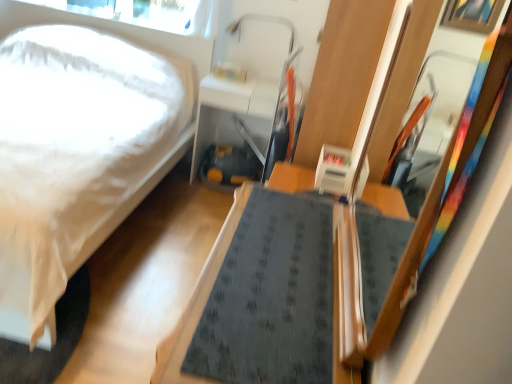
Question: Considering the positions of wooden framed mirror at right and transparent glass window screen at upper left in the image, is wooden framed mirror at right wider or thinner than transparent glass window screen at upper left?

Choices:
 (A) wide
 (B) thin

Answer: (A)

Question: Considering the positions of wooden framed mirror at right and transparent glass window screen at upper left in the image, is wooden framed mirror at right taller or shorter than transparent glass window screen at upper left?

Choices:
 (A) tall
 (B) short

Answer: (A)

Question: Which is nearer to the wooden framed mirror at right?

Choices:
 (A) matte white table at center, the second table from the front
 (B) transparent glass window screen at upper left
 (C) white matte bed at left
 (D) dark gray fabric table at center, which appears as the 1th table when viewed from the front

Answer: (D)

Question: Considering the real-world distances, which object is closest to the dark gray fabric table at center, which ranks as the 1th table in bottom-to-top order?

Choices:
 (A) transparent glass window screen at upper left
 (B) wooden framed mirror at right
 (C) matte white table at center, marked as the first table in a top-to-bottom arrangement
 (D) white matte bed at left

Answer: (B)